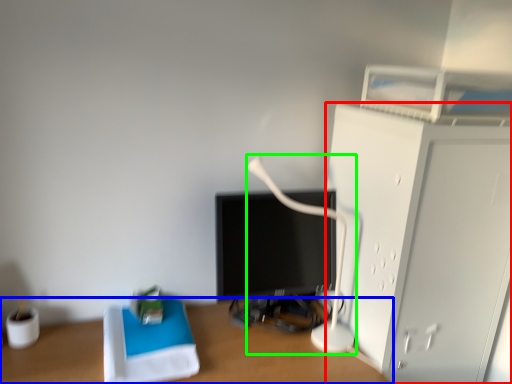
Question: Which is farther away from furniture (highlighted by a red box)? desk (highlighted by a blue box) or table lamp (highlighted by a green box)?

Choices:
 (A) desk
 (B) table lamp

Answer: (A)